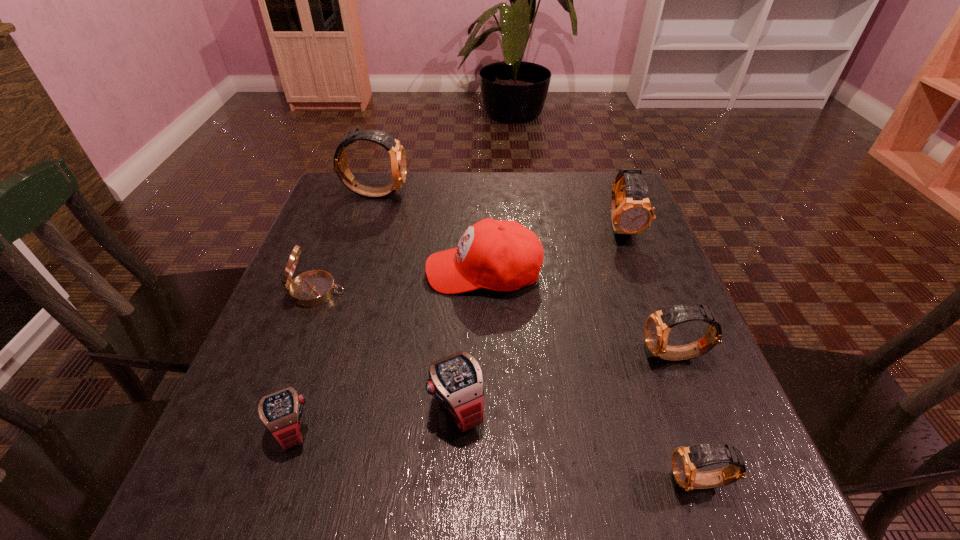
Find the location of `vacant space located 0.150m on the face of the second smallest gold watch`. vacant space located 0.150m on the face of the second smallest gold watch is located at coordinates (562, 356).

Where is `blank space located 0.390m on the face of the second smallest gold watch`? blank space located 0.390m on the face of the second smallest gold watch is located at coordinates (432, 356).

Identify the location of free region located 0.120m with the dial facing the compass. (400, 292).

Where is `free space located 0.210m on the right of the third watch from left to right`? free space located 0.210m on the right of the third watch from left to right is located at coordinates (609, 407).

Locate an element on the screen. free space located 0.100m on the face of the smallest gold watch is located at coordinates (602, 482).

I want to click on free space located 0.190m on the face of the smallest gold watch, so click(x=540, y=482).

This screenshot has height=540, width=960. Identify the location of free region located on the face of the smallest gold watch. (513, 482).

Where is `free region located on the back of the smaller red watch`? free region located on the back of the smaller red watch is located at coordinates (324, 339).

Where is `compass positioned at the left edge`? Image resolution: width=960 pixels, height=540 pixels. compass positioned at the left edge is located at coordinates (312, 288).

Locate an element on the screen. This screenshot has width=960, height=540. object that is at the far left corner is located at coordinates (397, 153).